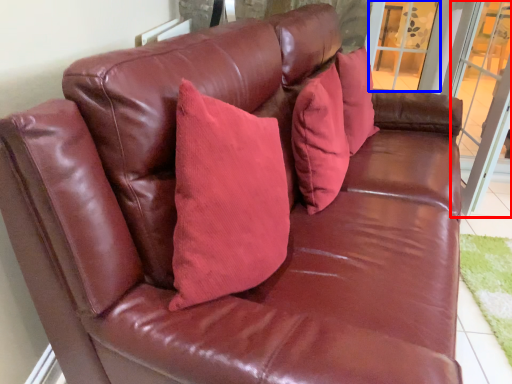
Question: Among these objects, which one is farthest to the camera, screen door (highlighted by a red box) or window (highlighted by a blue box)?

Choices:
 (A) screen door
 (B) window

Answer: (B)